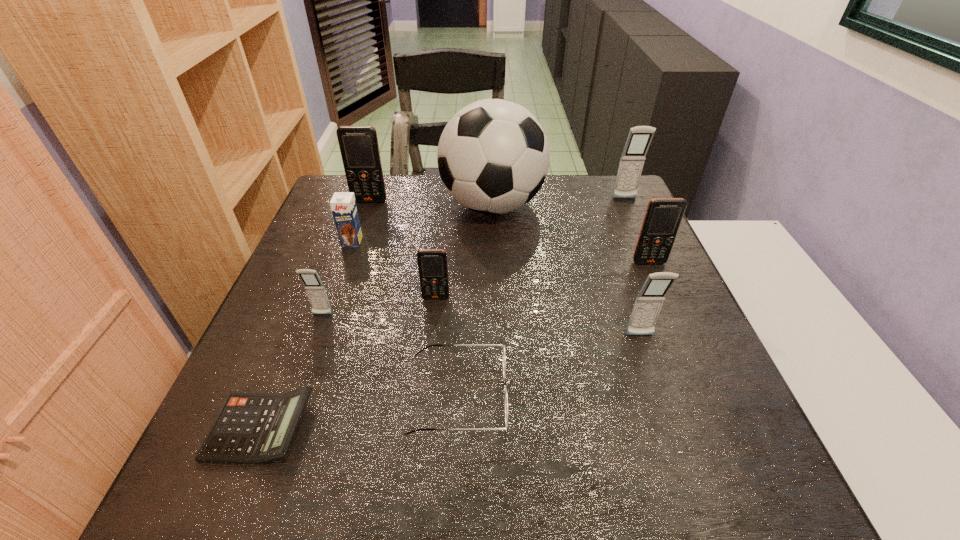
At what (x,y) coordinates should I click in order to perform the action: click on chocolate milk. Please return your answer as a coordinate pair (x, y). The image size is (960, 540). Looking at the image, I should click on (343, 204).

Where is `the nearest orange cellular telephone`? the nearest orange cellular telephone is located at coordinates [x=432, y=263].

Find the location of `the third cellular telephone from left to right`. the third cellular telephone from left to right is located at coordinates (432, 263).

Locate an element on the screen. the leftmost gray cellular telephone is located at coordinates (315, 290).

In order to click on the seventh farthest object in this screenshot , I will do `click(315, 290)`.

You are a GUI agent. You are given a task and a screenshot of the screen. Output one action in this format:
    pyautogui.click(x=<x>, y=<y>)
    Task: Click on the spectacles
    This screenshot has width=960, height=540.
    Given the screenshot: What is the action you would take?
    pyautogui.click(x=498, y=345)

At what (x,y) coordinates should I click in order to perform the action: click on black spectacles. Please return your answer as a coordinate pair (x, y). The image size is (960, 540). Looking at the image, I should click on (498, 345).

This screenshot has width=960, height=540. I want to click on calculator, so click(251, 428).

What are the coordinates of `vacant space located on the right of the tallest object` in the screenshot? It's located at (565, 206).

Where is `free point located 0.060m on the front-facing side of the farthest gray cellular telephone`? free point located 0.060m on the front-facing side of the farthest gray cellular telephone is located at coordinates (631, 213).